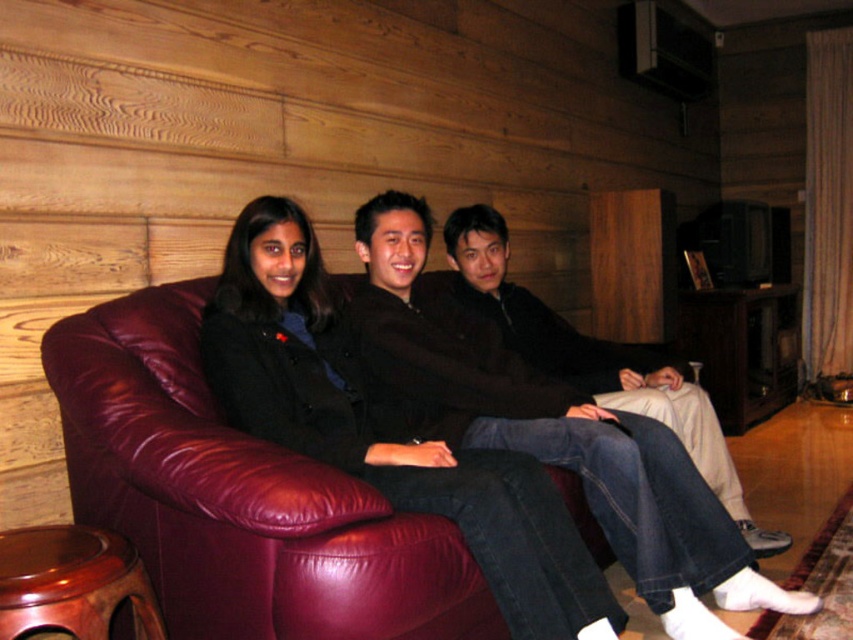
Question: Which object is the closest to the mahogany wood stool at lower left?

Choices:
 (A) matte black jacket at center
 (B) maroon leather couch at center
 (C) dark brown leather jacket at center

Answer: (B)

Question: Is maroon leather couch at center below mahogany wood stool at lower left?

Choices:
 (A) no
 (B) yes

Answer: (A)

Question: Among these points, which one is farthest from the camera?

Choices:
 (A) (585, 346)
 (B) (668, 461)
 (C) (91, 336)
 (D) (7, 600)

Answer: (A)

Question: Which of the following is the closest to the observer?

Choices:
 (A) (13, 586)
 (B) (630, 400)
 (C) (109, 464)

Answer: (A)

Question: From the image, what is the correct spatial relationship of matte black jacket at center in relation to dark brown leather jacket at center?

Choices:
 (A) left
 (B) right

Answer: (A)

Question: Is maroon leather couch at center wider than dark brown leather jacket at center?

Choices:
 (A) yes
 (B) no

Answer: (B)